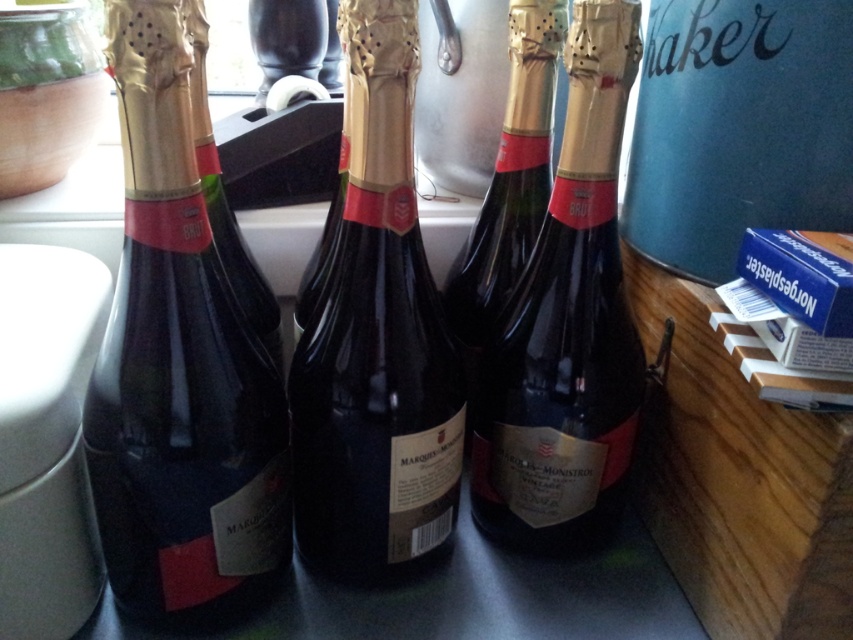
You are organizing a wine tasting event and need to arrange the bottles from tallest to shortest. Given the matte black bottle at left and the dark glass bottle at center, which one should you place first in the lineup?

The matte black bottle at left should be placed first in the lineup since it is taller than the dark glass bottle at center.

Based on the photo, you are looking at the four champagne bottles arranged on the table. There are two points marked on the scene. The first point is at coordinate (160, 500) and the second is at (577, 276). Which of these two points is nearer to you?

Point (160, 500) is closer to the viewer than point (577, 276).

You are organizing a party and need to choose between the matte black bottle at left and the matte gold foil champagne bottle at center for a toast. Which bottle has a larger capacity?

The matte black bottle at left is bigger than the matte gold foil champagne bottle at center, so it has a larger capacity.